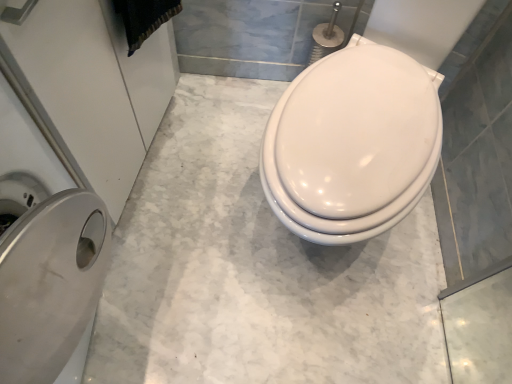
Question: Could white glossy toilet at center be considered to be inside silver metallic trash can at left?

Choices:
 (A) yes
 (B) no

Answer: (B)

Question: Can you confirm if silver metallic trash can at left is taller than white glossy toilet at center?

Choices:
 (A) no
 (B) yes

Answer: (A)

Question: From the image's perspective, is silver metallic trash can at left under white glossy toilet at center?

Choices:
 (A) yes
 (B) no

Answer: (A)

Question: Is silver metallic trash can at left positioned in front of white glossy toilet at center?

Choices:
 (A) no
 (B) yes

Answer: (B)

Question: Does silver metallic trash can at left come behind white glossy toilet at center?

Choices:
 (A) no
 (B) yes

Answer: (A)

Question: Considering the relative sizes of silver metallic trash can at left and white glossy toilet at center in the image provided, is silver metallic trash can at left smaller than white glossy toilet at center?

Choices:
 (A) no
 (B) yes

Answer: (B)

Question: From a real-world perspective, is white glossy toilet at center positioned under silver metallic trash can at left based on gravity?

Choices:
 (A) yes
 (B) no

Answer: (B)

Question: From the image's perspective, is white glossy toilet at center on silver metallic trash can at left?

Choices:
 (A) no
 (B) yes

Answer: (B)

Question: Can you confirm if white glossy toilet at center is positioned to the right of silver metallic trash can at left?

Choices:
 (A) no
 (B) yes

Answer: (B)

Question: Does white glossy toilet at center touch silver metallic trash can at left?

Choices:
 (A) no
 (B) yes

Answer: (A)

Question: Is white glossy toilet at center positioned in front of silver metallic trash can at left?

Choices:
 (A) yes
 (B) no

Answer: (B)

Question: Is white glossy toilet at center outside of silver metallic trash can at left?

Choices:
 (A) yes
 (B) no

Answer: (A)

Question: Does silver metallic trash can at left have a greater height compared to black fabric at upper left?

Choices:
 (A) no
 (B) yes

Answer: (B)